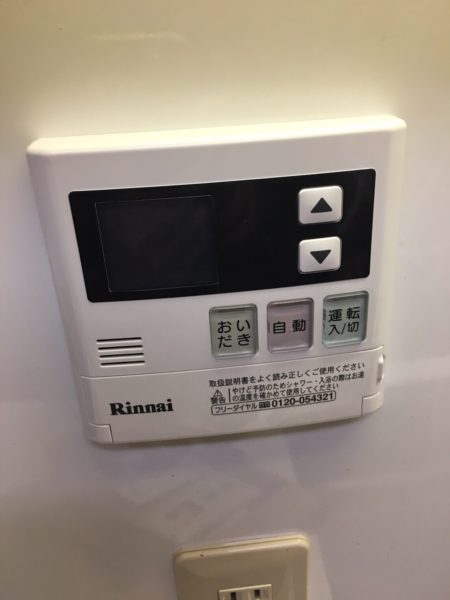
Identify the location of thermostat. pos(223,295).